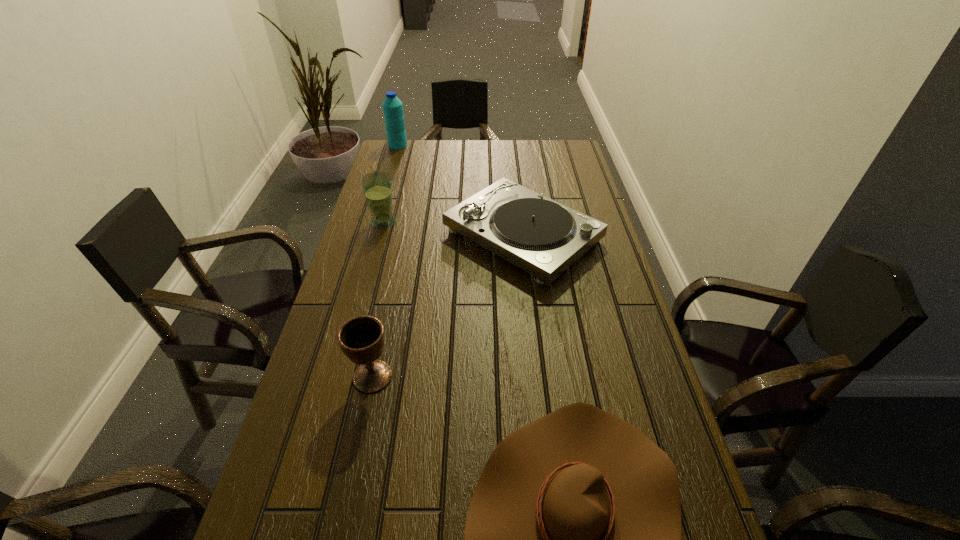
Where is `empty location between the fourth tallest object and the chalice`? The image size is (960, 540). empty location between the fourth tallest object and the chalice is located at coordinates (447, 306).

Locate an element on the screen. The height and width of the screenshot is (540, 960). vacant space that is in between the tallest object and the second nearest object is located at coordinates point(385,261).

Identify the location of empty space that is in between the farthest object and the chalice. The width and height of the screenshot is (960, 540). (385, 261).

The image size is (960, 540). Find the location of `free space between the chalice and the farthest object`. free space between the chalice and the farthest object is located at coordinates (385, 261).

The width and height of the screenshot is (960, 540). I want to click on vacant region between the record player and the second nearest object, so click(447, 306).

This screenshot has width=960, height=540. Find the location of `object that can be found as the closest to the second nearest object`. object that can be found as the closest to the second nearest object is located at coordinates (572, 539).

Point out which object is positioned as the fourth nearest to the cowboy hat. Please provide its 2D coordinates. Your answer should be formatted as a tuple, i.e. [(x, y)], where the tuple contains the x and y coordinates of a point satisfying the conditions above.

[(392, 107)]

Locate an element on the screen. This screenshot has height=540, width=960. vacant region that satisfies the following two spatial constraints: 1. on the back side of the fourth tallest object; 2. on the left side of the fourth farthest object is located at coordinates (402, 236).

Find the location of a particular element. This screenshot has height=540, width=960. free space that satisfies the following two spatial constraints: 1. on the front side of the tallest object; 2. on the right side of the second shortest object is located at coordinates (371, 236).